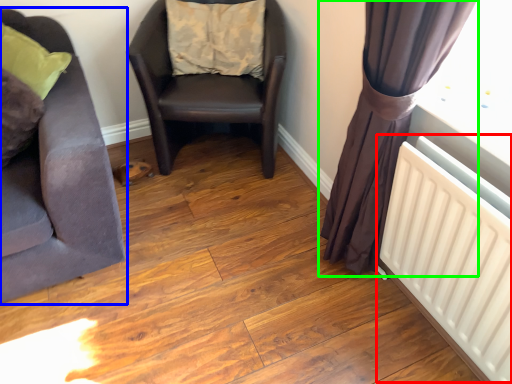
Question: Which object is the farthest from radiator (highlighted by a red box)? Choose among these: chair (highlighted by a blue box) or curtain (highlighted by a green box).

Choices:
 (A) chair
 (B) curtain

Answer: (A)